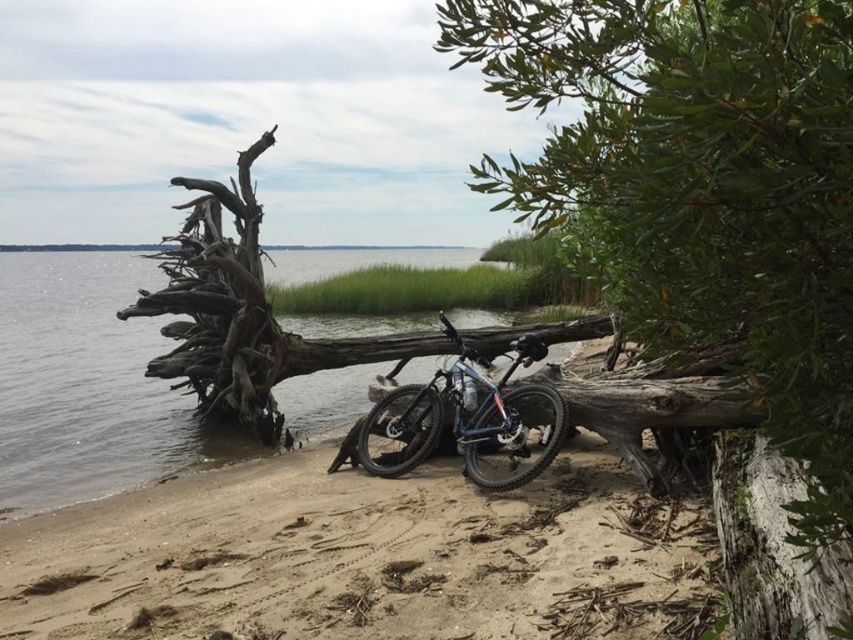
The width and height of the screenshot is (853, 640). What do you see at coordinates (366, 557) in the screenshot? I see `sandy beach at lower left` at bounding box center [366, 557].

Can you confirm if sandy beach at lower left is bigger than clear water at center?

Actually, sandy beach at lower left might be smaller than clear water at center.

Which is in front, point (244, 598) or point (140, 403)?

Point (244, 598)

The width and height of the screenshot is (853, 640). What are the coordinates of `sandy beach at lower left` in the screenshot? It's located at (366, 557).

Does point (90, 257) come closer to viewer compared to point (397, 390)?

No.

Who is more distant from viewer, (68, 340) or (469, 433)?

The point (68, 340) is more distant.

Describe the element at coordinates (86, 384) in the screenshot. The image size is (853, 640). I see `clear water at center` at that location.

Identify the location of clear water at center. (86, 384).

Which is in front, point (735, 195) or point (648, 497)?

Point (735, 195)

Which is behind, point (849, 148) or point (583, 545)?

Positioned behind is point (583, 545).

Which is in front, point (836, 26) or point (28, 616)?

Positioned in front is point (836, 26).

What are the coordinates of `green leafy tree at center` in the screenshot? It's located at pos(699,188).